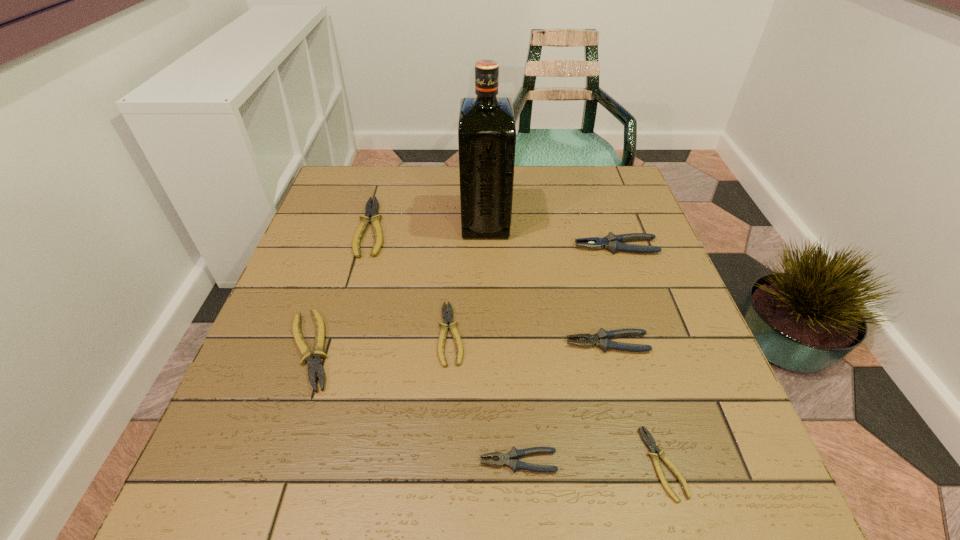
This screenshot has width=960, height=540. Identify the location of the rightmost yellow pliers. (650, 443).

Locate an element on the screen. the smallest yellow pliers is located at coordinates (650, 443).

At what (x,y) coordinates should I click in order to perform the action: click on free space located 0.300m on the front label of the liquor. Please return your answer as a coordinate pair (x, y). The height and width of the screenshot is (540, 960). Looking at the image, I should click on (352, 221).

Locate an element on the screen. Image resolution: width=960 pixels, height=540 pixels. free point located 0.120m on the front label of the liquor is located at coordinates (419, 221).

In order to click on free space located on the front label of the liquor in this screenshot , I will do (x=400, y=221).

Find the location of a particular element. The height and width of the screenshot is (540, 960). vacant space situated at the gripping part of the biggest gray pliers is located at coordinates (520, 247).

Identify the location of free spot located at the gripping part of the biggest gray pliers. (473, 247).

Locate an element on the screen. Image resolution: width=960 pixels, height=540 pixels. free location located at the gripping part of the biggest gray pliers is located at coordinates (540, 247).

Where is `free region located at the gripping part of the second biggest gray pliers`? This screenshot has width=960, height=540. free region located at the gripping part of the second biggest gray pliers is located at coordinates (513, 343).

The height and width of the screenshot is (540, 960). I want to click on free spot located at the gripping part of the second biggest gray pliers, so click(464, 343).